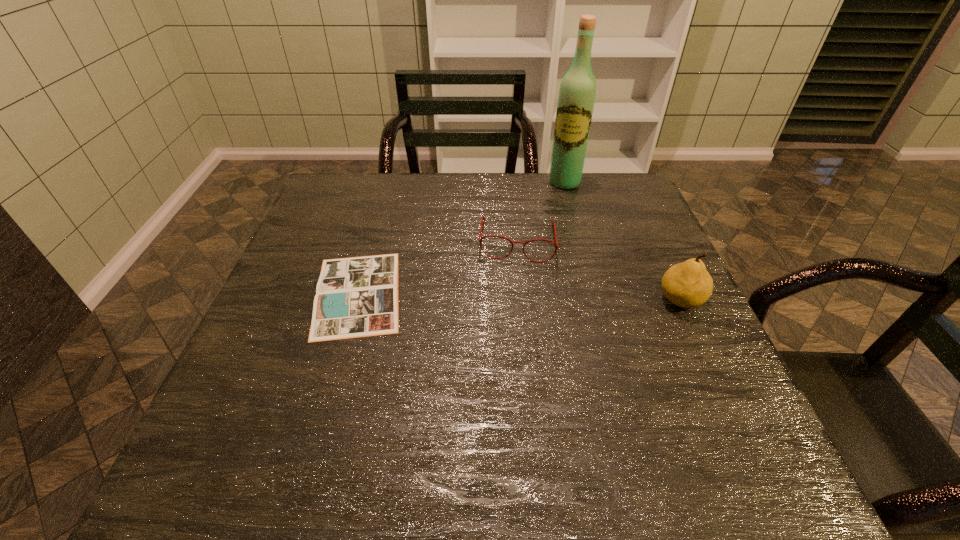
Locate an element on the screen. book is located at coordinates (355, 297).

Locate an element on the screen. Image resolution: width=960 pixels, height=540 pixels. the leftmost object is located at coordinates (355, 297).

Identify the location of the rightmost object. (688, 284).

Where is `the second tallest object`? the second tallest object is located at coordinates (688, 284).

The width and height of the screenshot is (960, 540). Find the location of `the tallest object`. the tallest object is located at coordinates click(x=577, y=92).

This screenshot has height=540, width=960. Find the location of `the farthest object`. the farthest object is located at coordinates (577, 92).

Identify the location of the second shortest object. The height and width of the screenshot is (540, 960). (483, 218).

At what (x,y) coordinates should I click in order to perform the action: click on spectacles. Please return your answer as a coordinate pair (x, y). This screenshot has height=540, width=960. Looking at the image, I should click on (483, 218).

Where is `vacant area situated on the right of the book`? vacant area situated on the right of the book is located at coordinates (549, 294).

Locate an element on the screen. vacant space located on the left of the pear is located at coordinates (632, 300).